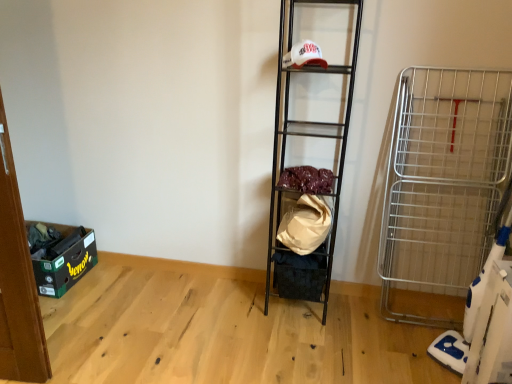
Image resolution: width=512 pixels, height=384 pixels. What are the coordinates of `vacant space that is to the left of metallic black shelf at center` in the screenshot? It's located at (238, 307).